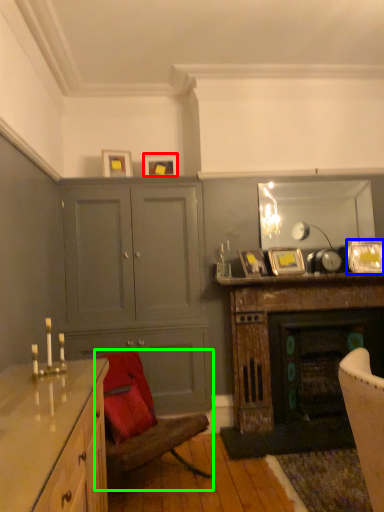
Question: Considering the real-world distances, which object is farthest from picture frame (highlighted by a red box)? picture frame (highlighted by a blue box) or chair (highlighted by a green box)?

Choices:
 (A) picture frame
 (B) chair

Answer: (B)